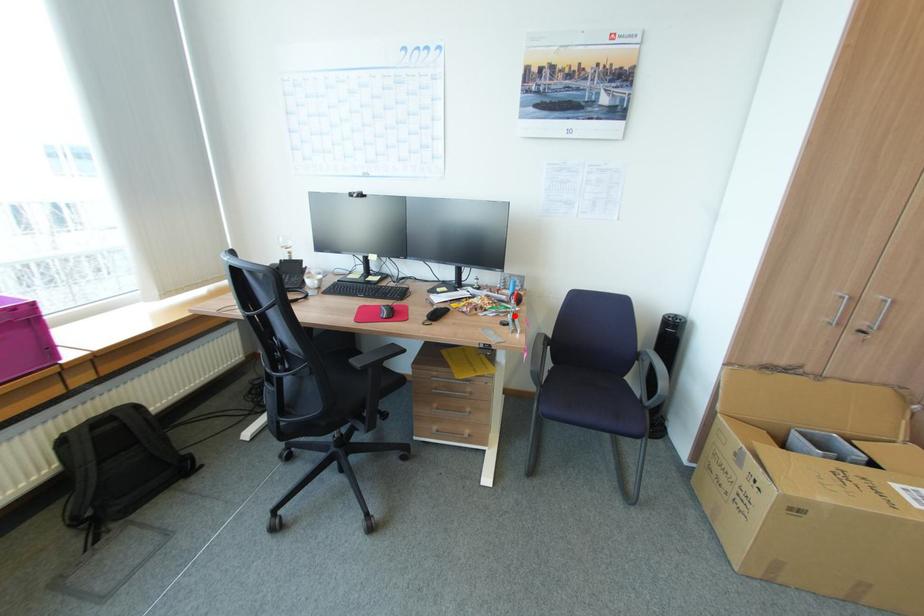
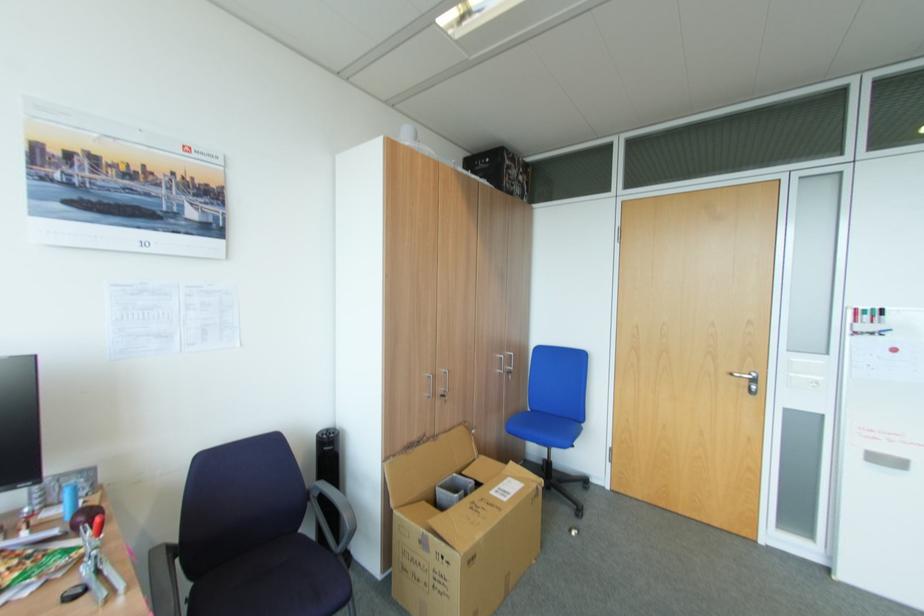
The point at the highlighted location is marked in the first image. Where is the corresponding point in the second image?

(91, 569)